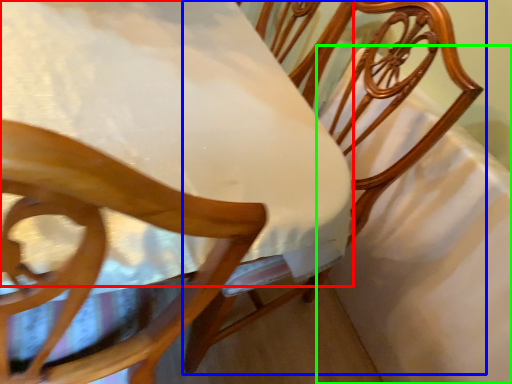
Question: Estimate the real-world distances between objects in this image. Which object is farther from table (highlighted by a red box), chair (highlighted by a blue box) or sheet (highlighted by a green box)?

Choices:
 (A) chair
 (B) sheet

Answer: (B)